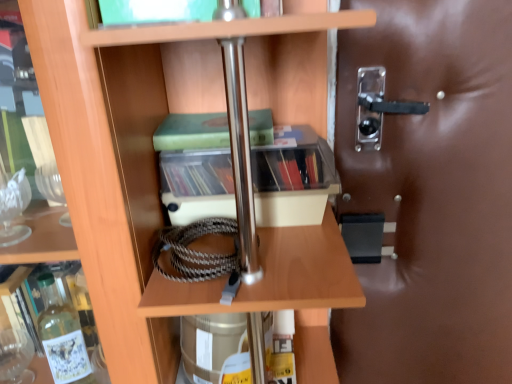
Question: From the image's perspective, is clear plastic storage at center located beneath wooden shelf at center?

Choices:
 (A) yes
 (B) no

Answer: (B)

Question: Does clear plastic storage at center have a lesser height compared to wooden shelf at center?

Choices:
 (A) no
 (B) yes

Answer: (B)

Question: Is clear plastic storage at center completely or partially outside of wooden shelf at center?

Choices:
 (A) yes
 (B) no

Answer: (B)

Question: Is clear plastic storage at center smaller than wooden shelf at center?

Choices:
 (A) no
 (B) yes

Answer: (B)

Question: Is clear plastic storage at center not close to wooden shelf at center?

Choices:
 (A) no
 (B) yes

Answer: (A)

Question: From the image's perspective, is clear plastic storage at center on wooden shelf at center?

Choices:
 (A) no
 (B) yes

Answer: (B)

Question: Can you confirm if clear plastic storage at center is wider than green matte book at center?

Choices:
 (A) no
 (B) yes

Answer: (B)

Question: Does clear plastic storage at center have a lesser height compared to green matte book at center?

Choices:
 (A) yes
 (B) no

Answer: (B)

Question: Is clear plastic storage at center located outside green matte book at center?

Choices:
 (A) no
 (B) yes

Answer: (B)

Question: Can you confirm if clear plastic storage at center is bigger than green matte book at center?

Choices:
 (A) yes
 (B) no

Answer: (A)

Question: Is green matte book at center inside clear plastic storage at center?

Choices:
 (A) yes
 (B) no

Answer: (B)

Question: From the image's perspective, would you say clear plastic storage at center is shown under green matte book at center?

Choices:
 (A) no
 (B) yes

Answer: (B)

Question: From the image's perspective, is clear plastic storage at center beneath transparent plastic handle at right?

Choices:
 (A) yes
 (B) no

Answer: (B)